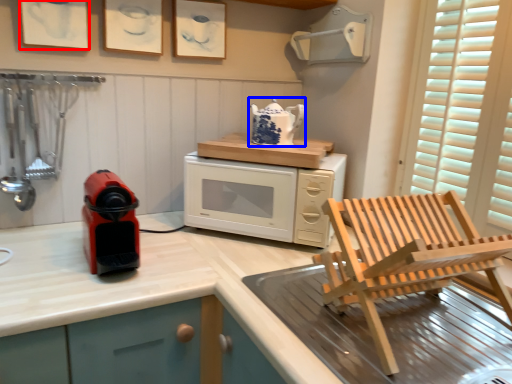
Question: Which object appears closest to the camera in this image, picture frame (highlighted by a red box) or kitchen appliance (highlighted by a blue box)?

Choices:
 (A) picture frame
 (B) kitchen appliance

Answer: (A)